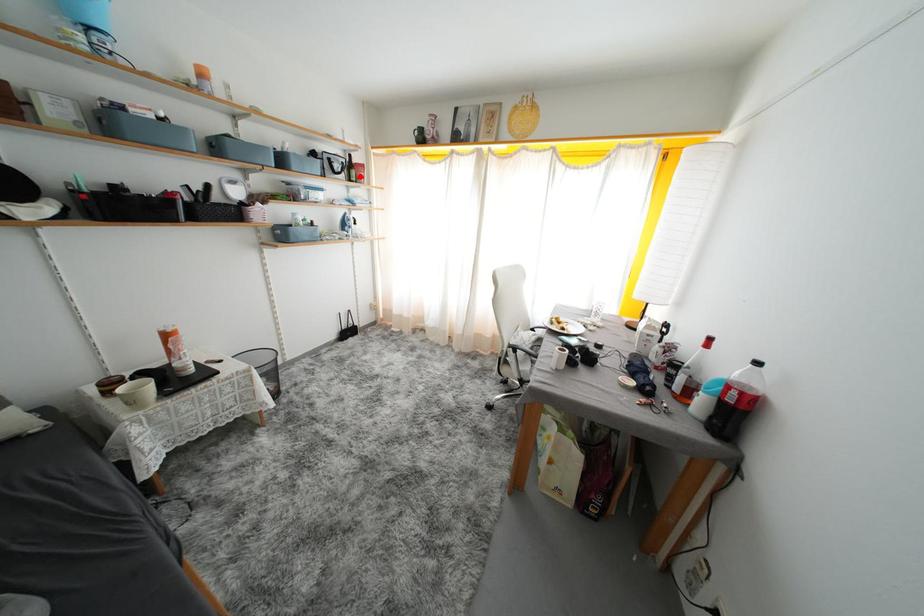
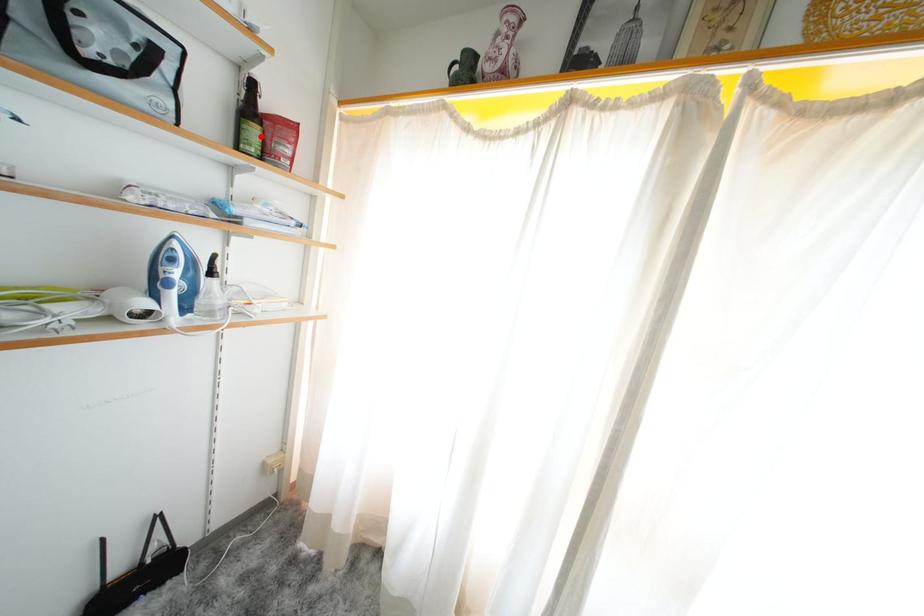
I am providing you with two images of the same scene from different viewpoints. A red point is marked on the first image and another point is marked on the second image. Is the red point in image1 aligned with the point shown in image2?

Yes